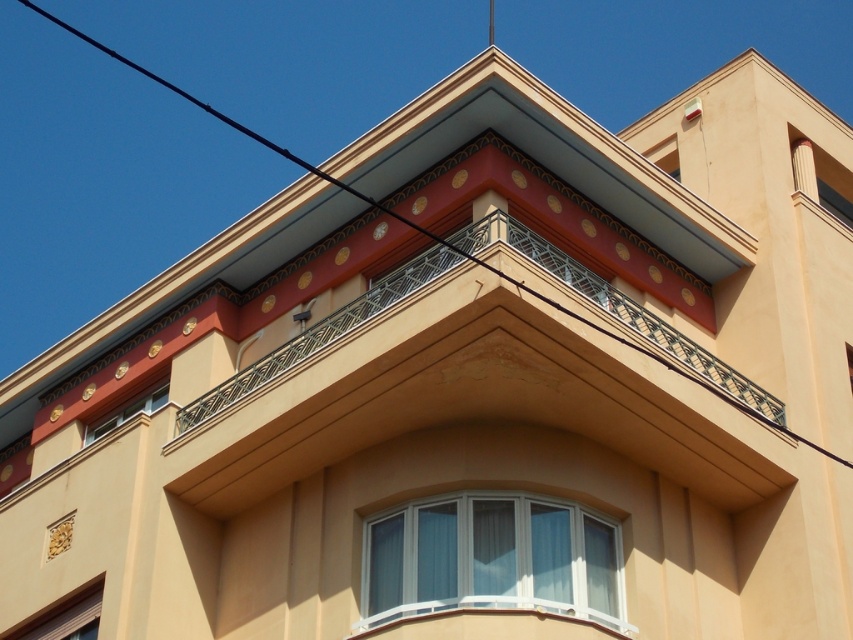
Question: Does white plastic window at center appear on the right side of matte gold window at upper left?

Choices:
 (A) yes
 (B) no

Answer: (A)

Question: Which point is farther from the camera taking this photo?

Choices:
 (A) (480, 500)
 (B) (82, 611)

Answer: (B)

Question: Considering the relative positions of white plastic window at center and matte gold window at upper left in the image provided, where is white plastic window at center located with respect to matte gold window at upper left?

Choices:
 (A) right
 (B) left

Answer: (A)

Question: Which object is farther from the camera taking this photo?

Choices:
 (A) white plastic window at center
 (B) matte gold window at upper left
 (C) matte beige window at lower left

Answer: (B)

Question: Is white plastic window at center positioned before matte gold window at upper left?

Choices:
 (A) no
 (B) yes

Answer: (B)

Question: Which point appears closest to the camera in this image?

Choices:
 (A) (93, 605)
 (B) (115, 408)
 (C) (373, 564)

Answer: (C)